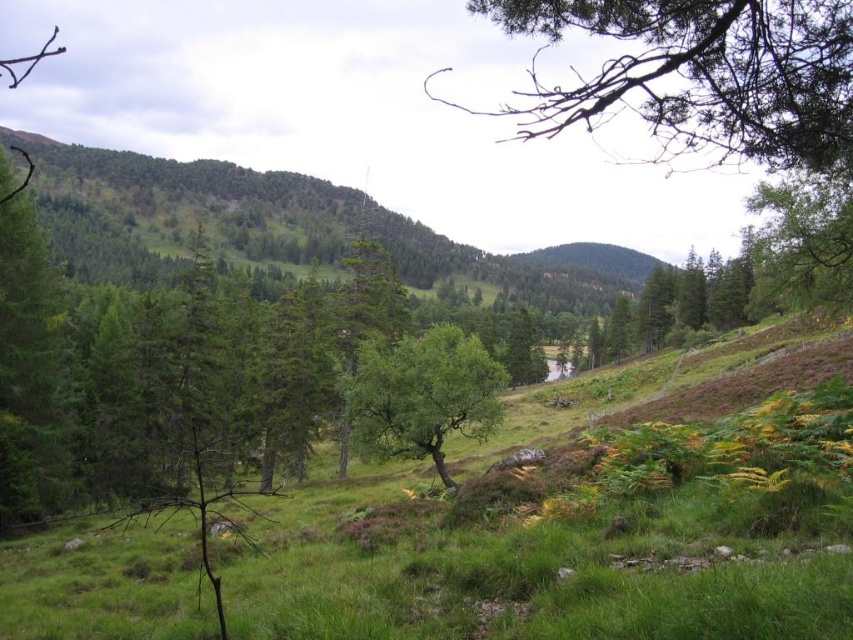
Find the location of a particular element. The image size is (853, 640). green leafy tree at upper right is located at coordinates (698, 76).

Does point (589, 12) come in front of point (479, 376)?

Yes, it is in front of point (479, 376).

The height and width of the screenshot is (640, 853). In order to click on green leafy tree at upper right in this screenshot , I will do `click(698, 76)`.